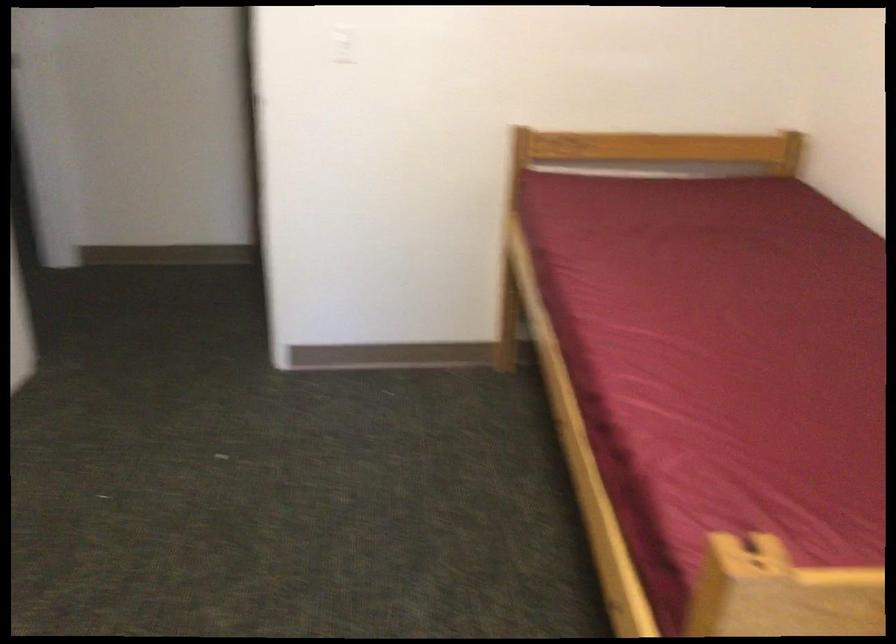
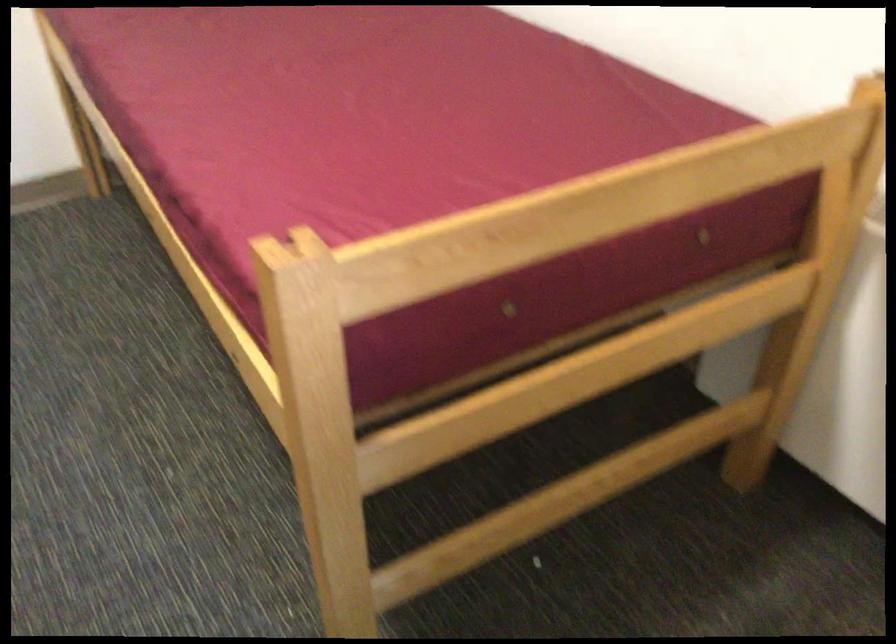
The first image is from the beginning of the video and the second image is from the end. How did the camera likely rotate when shooting the video?

The camera's rotation is toward right-down.